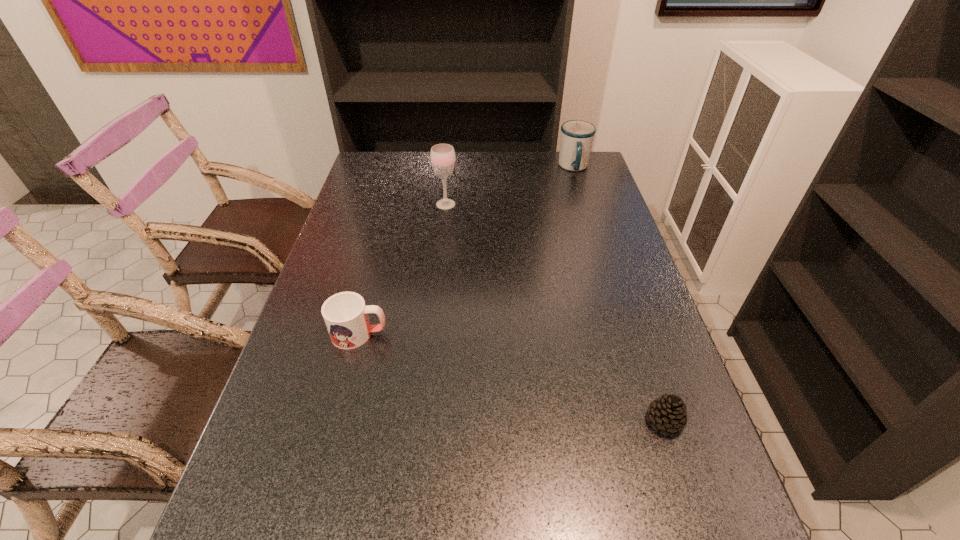
Identify the location of free location located on the side of the nearer mug with the handle. (461, 334).

The width and height of the screenshot is (960, 540). I want to click on vacant space located 0.240m at the narrow end of the pinecone, so click(x=530, y=421).

Image resolution: width=960 pixels, height=540 pixels. In order to click on free space located 0.270m at the narrow end of the pinecone in this screenshot , I will do tap(516, 421).

You are a GUI agent. You are given a task and a screenshot of the screen. Output one action in this format:
    pyautogui.click(x=<x>, y=<y>)
    Task: Click on the vacant space located at the narrow end of the pinecone
    This screenshot has width=960, height=540.
    Given the screenshot: What is the action you would take?
    pyautogui.click(x=564, y=421)

At what (x,y) coordinates should I click in order to perform the action: click on object at the far edge. Please return your answer as a coordinate pair (x, y). The width and height of the screenshot is (960, 540). Looking at the image, I should click on (577, 136).

Locate an element on the screen. This screenshot has width=960, height=540. object at the left edge is located at coordinates 345,314.

The height and width of the screenshot is (540, 960). What are the coordinates of `mug at the right edge` in the screenshot? It's located at (577, 136).

Image resolution: width=960 pixels, height=540 pixels. In order to click on pinecone at the right edge in this screenshot , I will do `click(667, 413)`.

I want to click on object at the far right corner, so click(x=577, y=136).

Locate an element on the screen. The height and width of the screenshot is (540, 960). free space at the far edge is located at coordinates (508, 151).